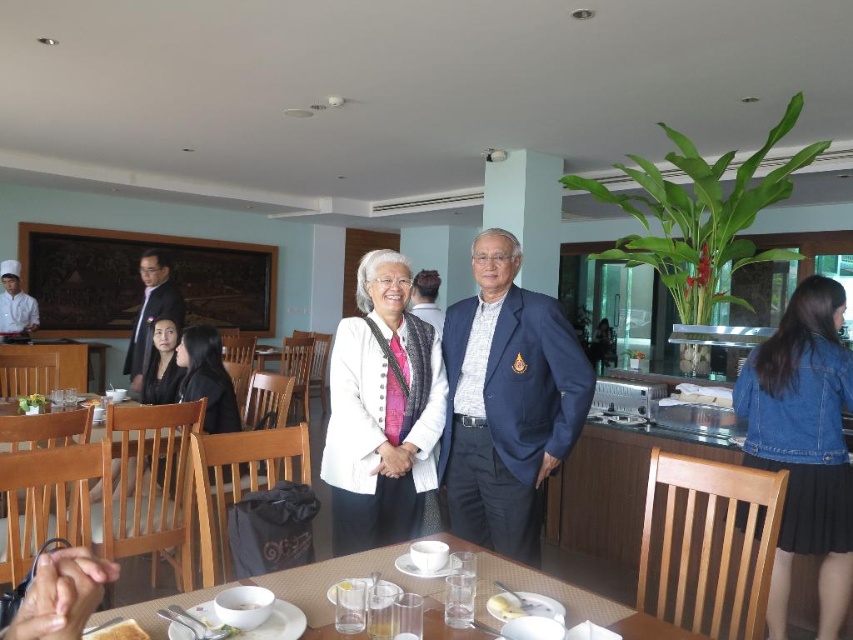
You are a photographer setting up for an event in this dining area. You need to position two guests exactly 7 feet apart for a group photo. Given the current positions of the navy blue suit at center and the black fabric jacket at lower left, can they maintain the required distance without moving?

The navy blue suit at center and black fabric jacket at lower left are currently 6.58 feet apart, which is slightly less than the required 7 feet. They would need to move approximately 0.42 feet further apart to meet the distance requirement.

You are a photographer setting up for an event in this dining area. You need to place a large equipment bag between the navy blue suit at center and the black fabric jacket at lower left. Which object should you place the bag next to to ensure it doesn

The navy blue suit at center is larger in size than the black fabric jacket at lower left, so you should place the large equipment bag next to the navy blue suit at center to accommodate its size.